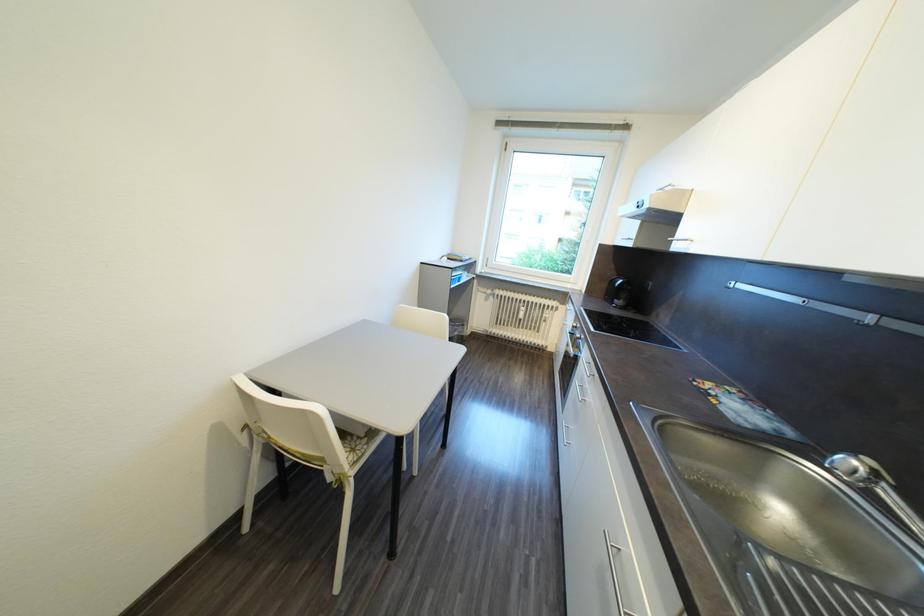
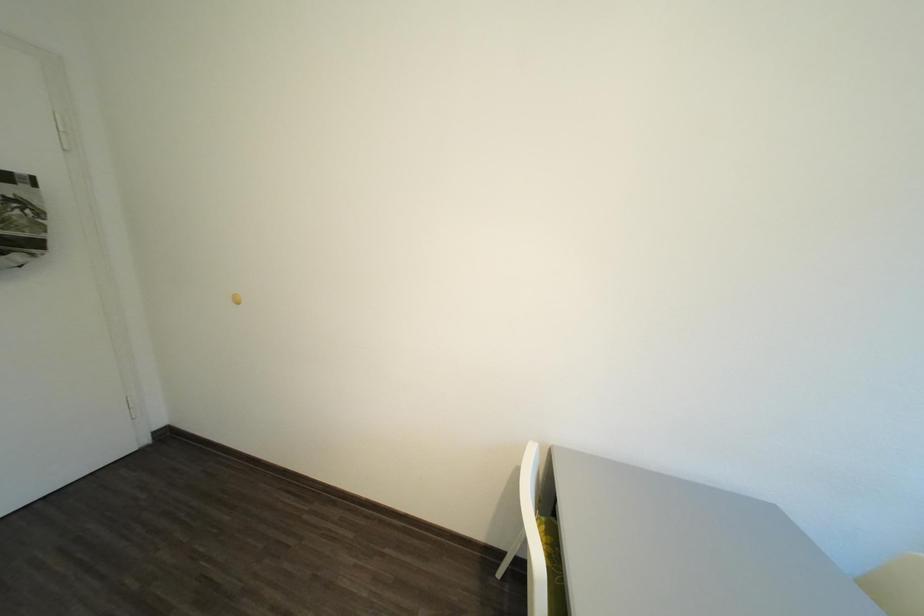
Question: The camera is either moving clockwise (left) or counter-clockwise (right) around the object. The first image is from the beginning of the video and the second image is from the end. Is the camera moving left or right when shooting the video?

Choices:
 (A) Left
 (B) Right

Answer: (B)